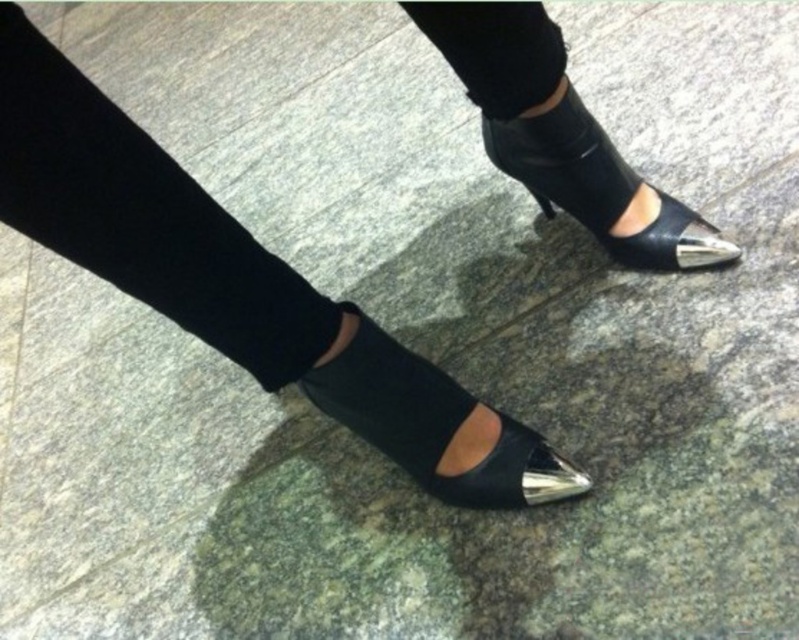
Measure the distance from black suede ankle boots at lower center to metallic leather sandal at center.

They are 17.86 inches apart.

Locate an element on the screen. black suede ankle boots at lower center is located at coordinates (142, 216).

You are a GUI agent. You are given a task and a screenshot of the screen. Output one action in this format:
    pyautogui.click(x=<x>, y=<y>)
    Task: Click on the black suede ankle boots at lower center
    Image resolution: width=799 pixels, height=640 pixels.
    Given the screenshot: What is the action you would take?
    pyautogui.click(x=142, y=216)

Is black leather shoes at center thinner than black suede ankle boots at lower center?

In fact, black leather shoes at center might be wider than black suede ankle boots at lower center.

Which of these two, black leather shoes at center or black suede ankle boots at lower center, stands shorter?

black suede ankle boots at lower center is shorter.

In order to click on black leather shoes at center in this screenshot , I will do `click(237, 284)`.

How far apart are matte black sandal at lower center and metallic leather sandal at center?

matte black sandal at lower center is 14.19 inches away from metallic leather sandal at center.

Between matte black sandal at lower center and metallic leather sandal at center, which one has less height?

Standing shorter between the two is matte black sandal at lower center.

This screenshot has width=799, height=640. What do you see at coordinates (436, 426) in the screenshot? I see `matte black sandal at lower center` at bounding box center [436, 426].

This screenshot has width=799, height=640. What are the coordinates of `matte black sandal at lower center` in the screenshot? It's located at (436, 426).